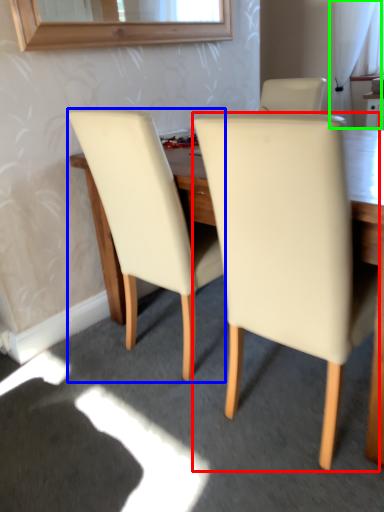
Question: Which object is the closest to the chair (highlighted by a red box)? Choose among these: chair (highlighted by a blue box) or curtain (highlighted by a green box).

Choices:
 (A) chair
 (B) curtain

Answer: (A)